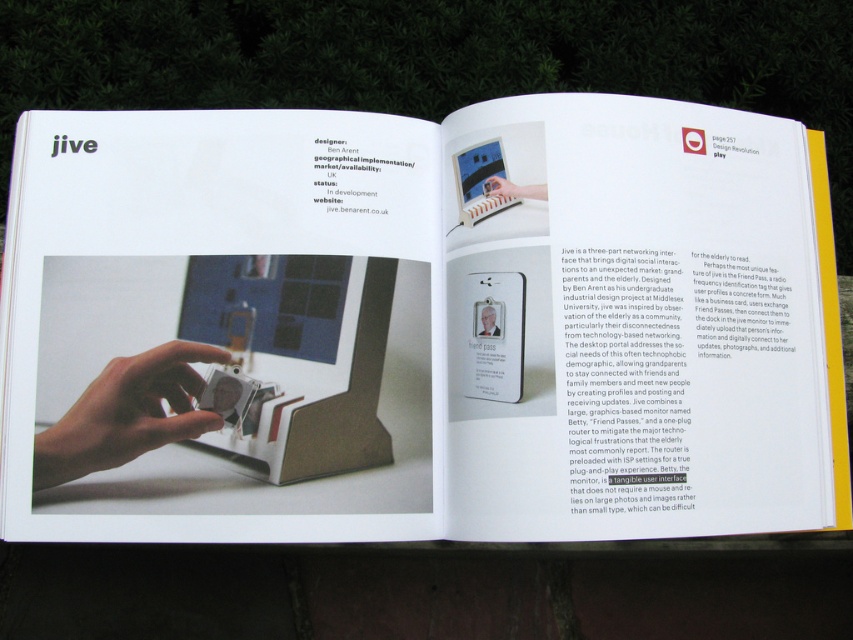
Question: Does white plastic device at center have a lesser width compared to smooth plastic hand at center?

Choices:
 (A) yes
 (B) no

Answer: (B)

Question: Which of the following is the farthest from the observer?

Choices:
 (A) (102, 394)
 (B) (474, 305)
 (C) (503, 192)

Answer: (C)

Question: Among these objects, which one is farthest from the camera?

Choices:
 (A) smooth plastic hand at center
 (B) silver metallic badge at center
 (C) white plastic device at center
 (D) matte plastic hand at center

Answer: (D)

Question: Does smooth plastic hand at center have a larger size compared to silver metallic badge at center?

Choices:
 (A) no
 (B) yes

Answer: (B)

Question: Observing the image, what is the correct spatial positioning of white plastic device at center in reference to matte plastic hand at center?

Choices:
 (A) below
 (B) above

Answer: (A)

Question: Which point appears closest to the camera in this image?

Choices:
 (A) (x=654, y=476)
 (B) (x=74, y=445)
 (C) (x=495, y=310)

Answer: (A)